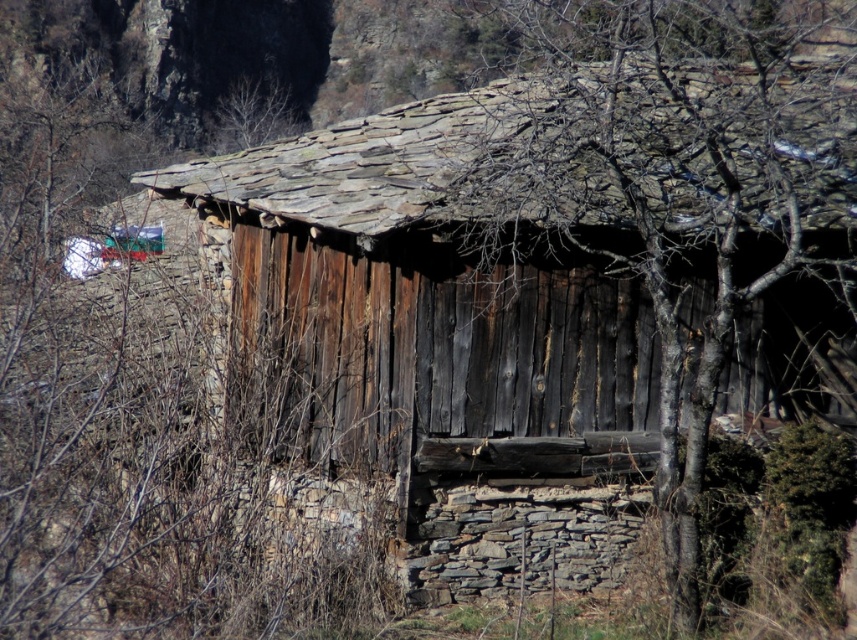
Question: Is brown rough bark tree at upper left closer to camera compared to brown rough bark tree at center?

Choices:
 (A) no
 (B) yes

Answer: (B)

Question: Based on their relative distances, which object is nearer to the bare branches at upper center?

Choices:
 (A) brown rough bark tree at center
 (B) brown rough bark tree at upper left

Answer: (B)

Question: Is brown rough bark tree at center to the left of bare branches at upper center from the viewer's perspective?

Choices:
 (A) yes
 (B) no

Answer: (B)

Question: Which point appears farthest from the camera in this image?

Choices:
 (A) (756, 253)
 (B) (15, 124)

Answer: (B)

Question: Based on their relative distances, which object is farther from the brown rough bark tree at center?

Choices:
 (A) brown rough bark tree at upper left
 (B) bare branches at upper center

Answer: (B)

Question: Does brown rough bark tree at upper left have a greater width compared to brown rough bark tree at center?

Choices:
 (A) yes
 (B) no

Answer: (A)